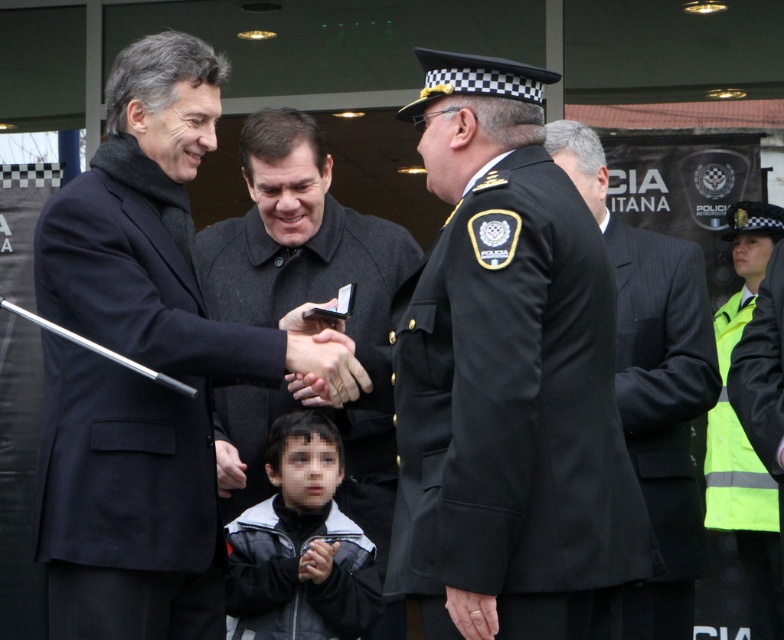
Between matte black coat at left and dark gray wool coat at center, which one appears on the left side from the viewer's perspective?

From the viewer's perspective, matte black coat at left appears more on the left side.

Between matte black coat at left and dark gray wool coat at center, which one appears on the right side from the viewer's perspective?

dark gray wool coat at center is more to the right.

Image resolution: width=784 pixels, height=640 pixels. I want to click on matte black coat at left, so click(x=143, y=364).

The width and height of the screenshot is (784, 640). Find the location of `matte black coat at left`. matte black coat at left is located at coordinates (143, 364).

Which is behind, point (418, 429) or point (661, 365)?

The point (661, 365) is behind.

Which is in front, point (470, 403) or point (690, 577)?

Positioned in front is point (470, 403).

Does point (456, 300) lie behind point (572, 157)?

No.

I want to click on black uniform at center, so click(507, 380).

Is point (688, 557) more distant than point (777, 572)?

That is False.

Between point (648, 628) and point (717, 536), which one is positioned in front?

Point (648, 628) is in front.

The height and width of the screenshot is (640, 784). Describe the element at coordinates (654, 384) in the screenshot. I see `black pinstripe suit at center` at that location.

Where is `black pinstripe suit at center`? black pinstripe suit at center is located at coordinates (654, 384).